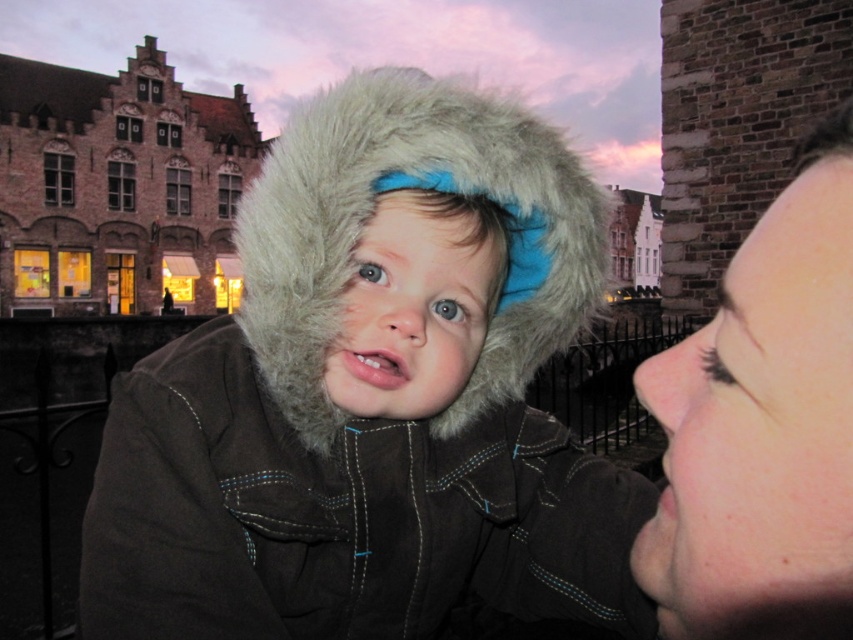
Does fuzzy brown coat at center appear over smooth skin face at upper right?

Actually, fuzzy brown coat at center is below smooth skin face at upper right.

Is fuzzy brown coat at center wider than smooth skin face at upper right?

Yes, fuzzy brown coat at center is wider than smooth skin face at upper right.

What do you see at coordinates (373, 396) in the screenshot? I see `fuzzy brown coat at center` at bounding box center [373, 396].

Identify the location of fuzzy brown coat at center. (373, 396).

Between fuzzy brown coat at center and fuzzy fur hood at center, which one has less height?

With less height is fuzzy fur hood at center.

Is fuzzy brown coat at center above fuzzy fur hood at center?

Actually, fuzzy brown coat at center is below fuzzy fur hood at center.

Who is more forward, (x=460, y=328) or (x=372, y=166)?

Point (x=372, y=166)

The image size is (853, 640). What are the coordinates of `fuzzy brown coat at center` in the screenshot? It's located at (373, 396).

Is smooth skin face at upper right to the left of fuzzy fur hood at center from the viewer's perspective?

Incorrect, smooth skin face at upper right is not on the left side of fuzzy fur hood at center.

Based on the photo, does smooth skin face at upper right have a larger size compared to fuzzy fur hood at center?

No, smooth skin face at upper right is not bigger than fuzzy fur hood at center.

Does point (775, 440) lie in front of point (328, 298)?

Yes, it is.

Find the location of a particular element. The width and height of the screenshot is (853, 640). smooth skin face at upper right is located at coordinates (763, 426).